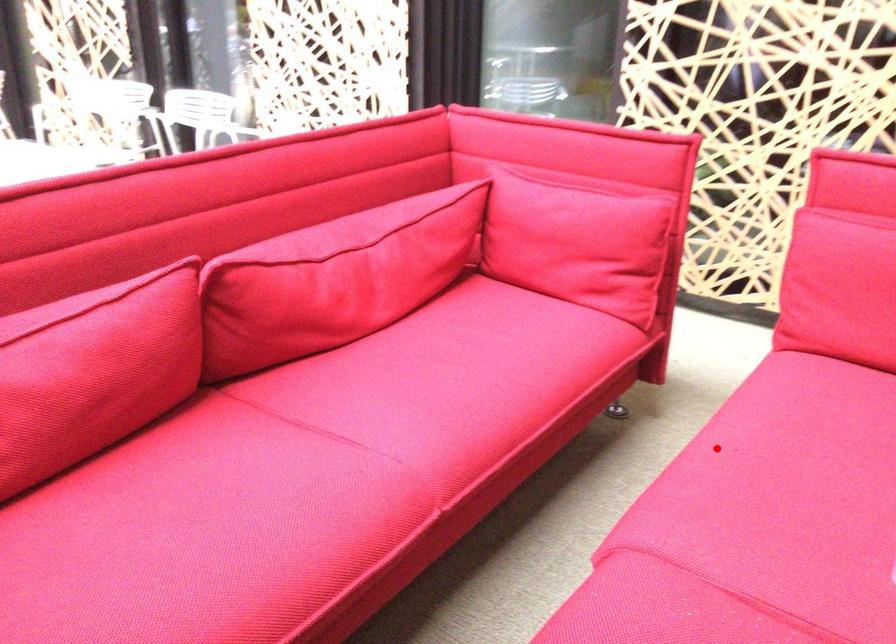
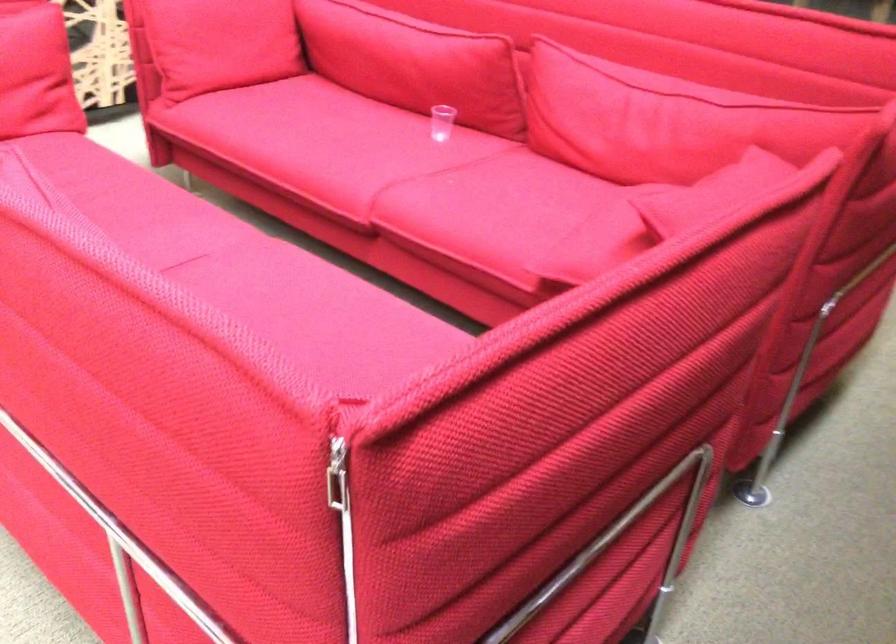
Question: I am providing you with two images of the same scene from different viewpoints. A red point is shown in image1. For the corresponding object point in image2, is it positioned nearer or farther from the camera?

Choices:
 (A) Nearer
 (B) Farther

Answer: (B)